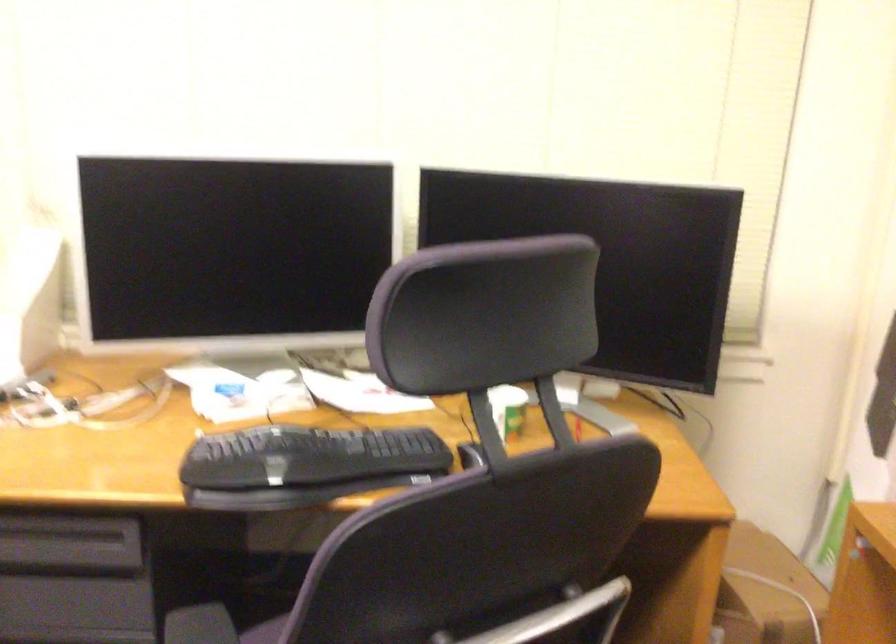
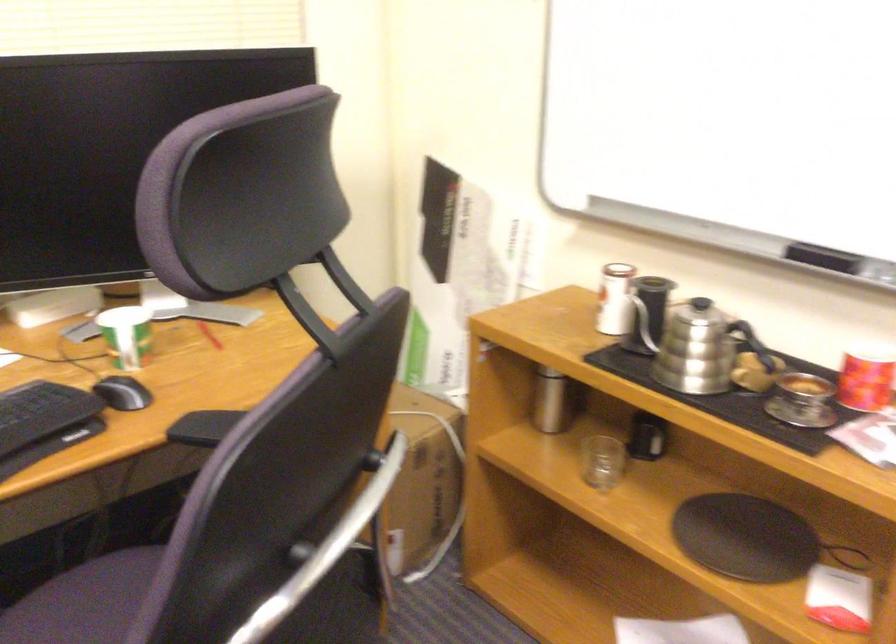
Question: The images are taken continuously from a first-person perspective. In which direction is your viewpoint rotating?

Choices:
 (A) Left
 (B) Right
 (C) Up
 (D) Down

Answer: (B)